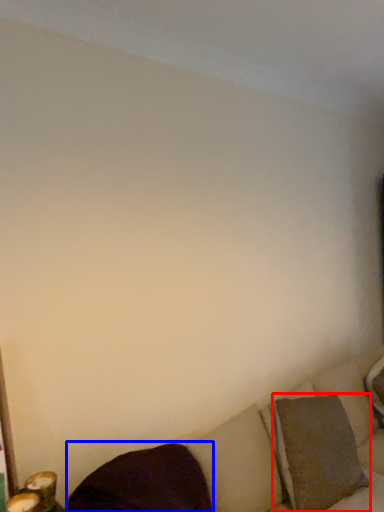
Question: Which point is further to the camera, pillow (highlighted by a red box) or pillow (highlighted by a blue box)?

Choices:
 (A) pillow
 (B) pillow

Answer: (A)